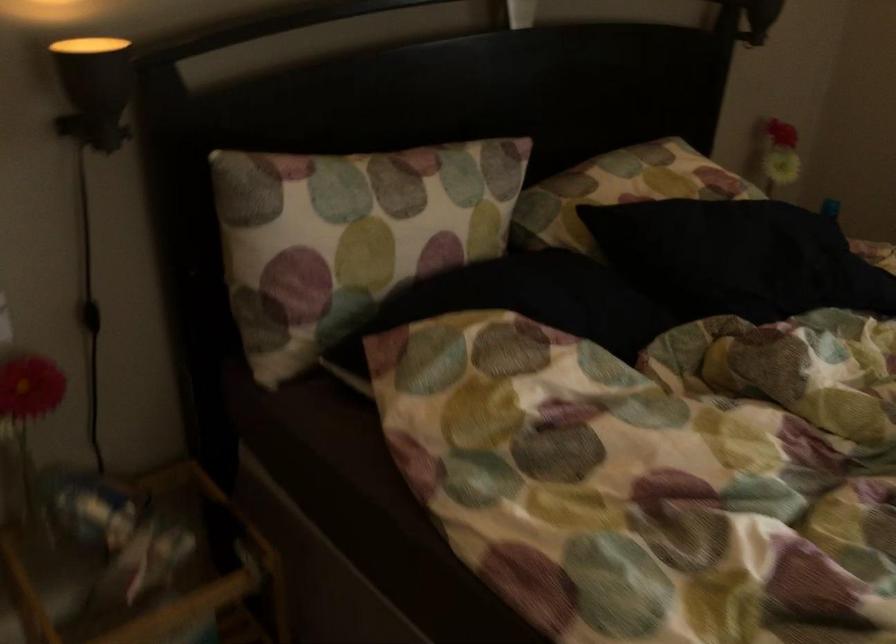
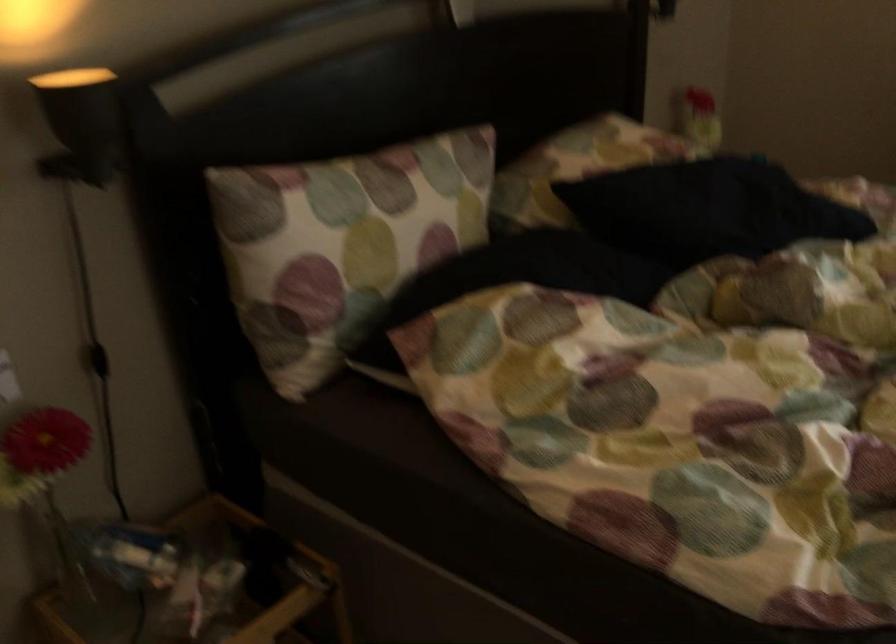
The point at (x=91, y=316) is marked in the first image. Where is the corresponding point in the second image?

(98, 360)